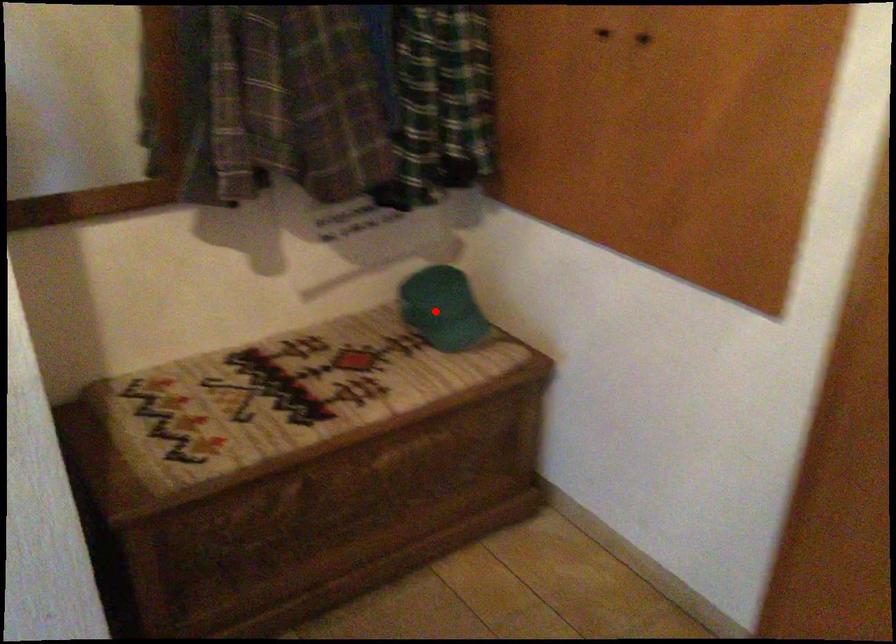
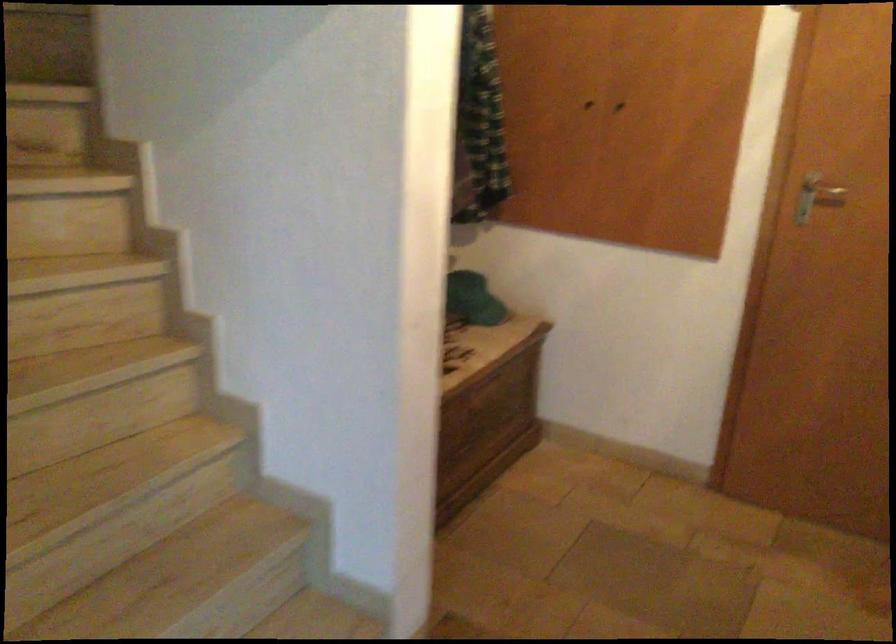
Locate, in the second image, the point that corresponds to the highlighted location in the first image.

(472, 299)